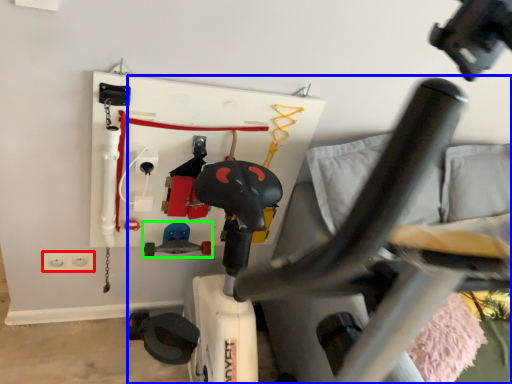
Question: Estimate the real-world distances between objects in this image. Which object is closer to electric outlet (highlighted by a red box), swivel chair (highlighted by a blue box) or toy (highlighted by a green box)?

Choices:
 (A) swivel chair
 (B) toy

Answer: (B)